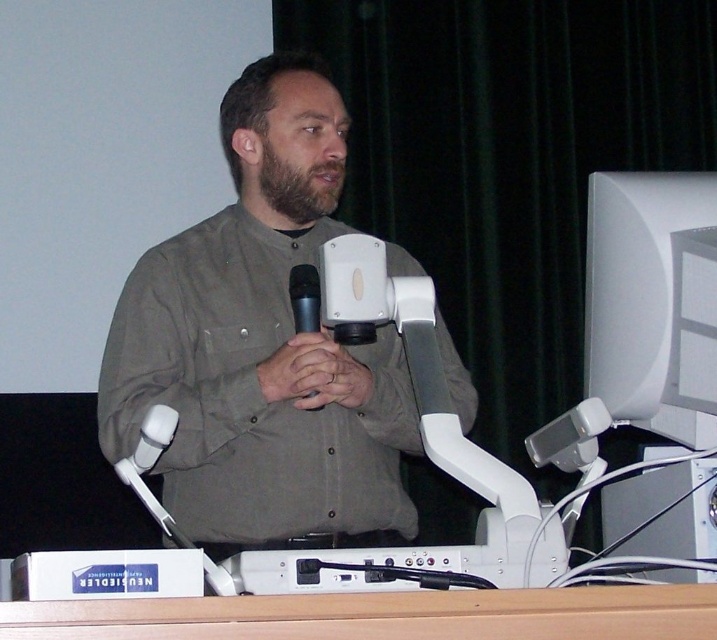
The height and width of the screenshot is (640, 717). Identify the location of brown fuzzy beard at center. (299, 184).

Is white plastic microphone at lower left positioned behind black matte microphone at center?

That is False.

From the picture: Can you confirm if white plastic microphone at lower left is smaller than black matte microphone at center?

No.

Which is behind, point (123, 468) or point (310, 294)?

Point (310, 294)

Where is `white plastic microphone at lower left`? The width and height of the screenshot is (717, 640). white plastic microphone at lower left is located at coordinates (148, 444).

Who is taller, brown fuzzy beard at center or white plastic microphone at lower left?

Standing taller between the two is brown fuzzy beard at center.

Does brown fuzzy beard at center have a larger size compared to white plastic microphone at lower left?

No.

Who is more distant from viewer, (295,225) or (138,468)?

Positioned behind is point (295,225).

At what (x,y) coordinates should I click in order to perform the action: click on brown fuzzy beard at center. Please return your answer as a coordinate pair (x, y). The height and width of the screenshot is (640, 717). Looking at the image, I should click on (299, 184).